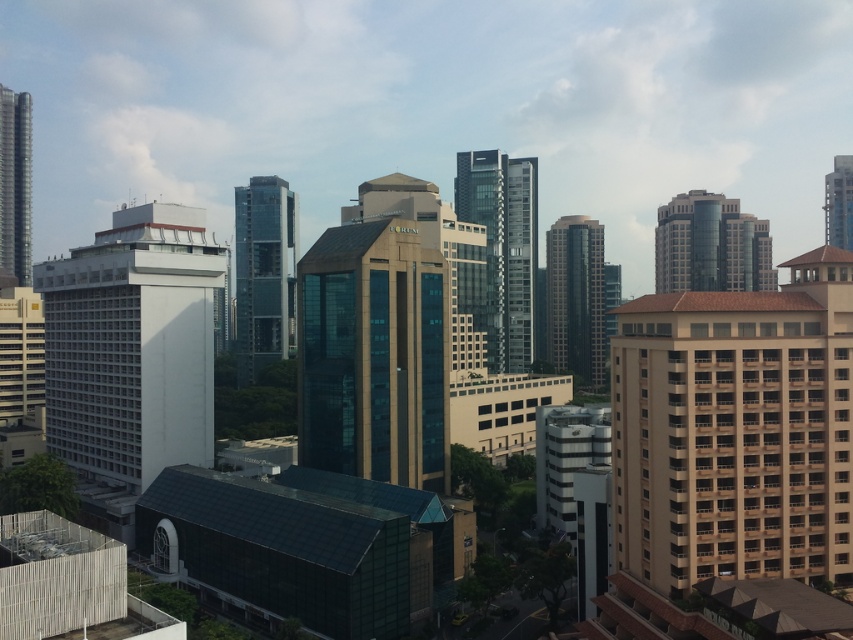
Question: Which of the following is the farthest from the observer?

Choices:
 (A) glassy metallic skyscraper at upper right
 (B) shiny metallic skyscraper at left
 (C) dark glass skyscraper at center
 (D) beige concrete building at right

Answer: (A)

Question: Considering the relative positions of shiny metallic skyscraper at left and glassy metallic skyscraper at upper right in the image provided, where is shiny metallic skyscraper at left located with respect to glassy metallic skyscraper at upper right?

Choices:
 (A) left
 (B) right

Answer: (A)

Question: Is beige concrete building at right bigger than glassy brown building at upper right?

Choices:
 (A) no
 (B) yes

Answer: (A)

Question: Which of these objects is positioned farthest from the shiny glass tower at center?

Choices:
 (A) beige concrete building at right
 (B) glassy steel skyscraper at center
 (C) dark glass skyscraper at center

Answer: (A)

Question: Is beige concrete building at right thinner than glassy steel skyscraper at center?

Choices:
 (A) yes
 (B) no

Answer: (A)

Question: Which object is closer to the camera taking this photo?

Choices:
 (A) white matte building at left
 (B) glassy metallic skyscraper at upper right

Answer: (A)